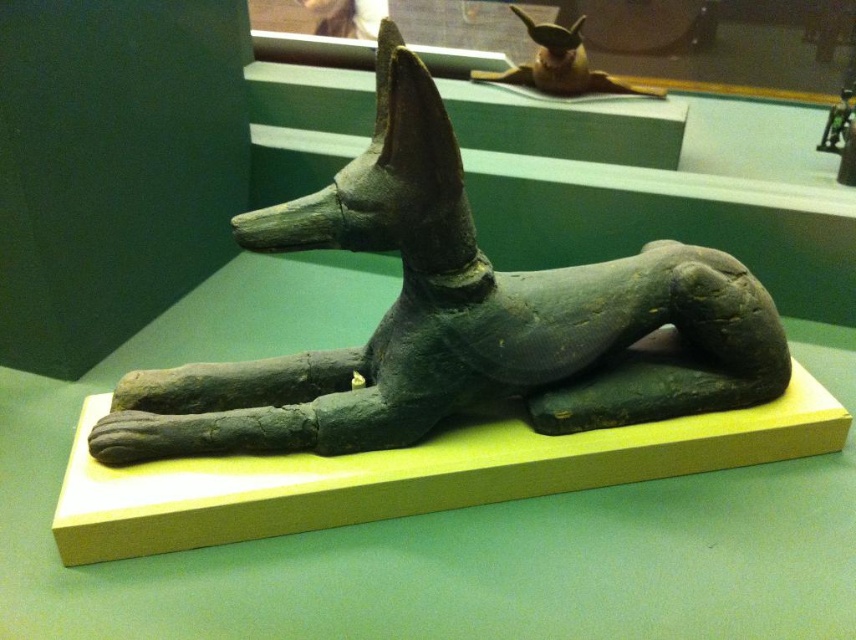
Does matte black statue at center have a smaller size compared to shiny gold statue at upper center?

Actually, matte black statue at center might be larger than shiny gold statue at upper center.

What are the coordinates of `matte black statue at center` in the screenshot? It's located at (455, 320).

Image resolution: width=856 pixels, height=640 pixels. I want to click on matte black statue at center, so click(455, 320).